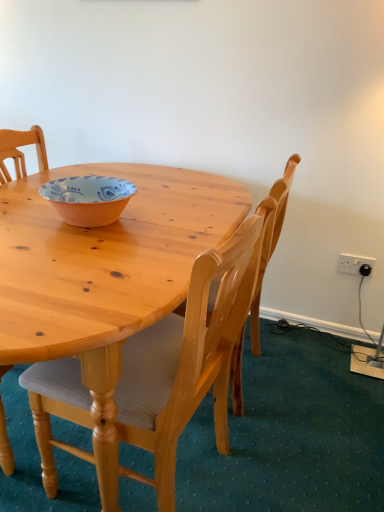
Question: Is light brown wood chair at center, which is the second chair in front-to-back order, at the right side of orange glazed bowl at center?

Choices:
 (A) no
 (B) yes

Answer: (B)

Question: Can you confirm if light brown wood chair at center, which is the second chair in front-to-back order, is thinner than orange glazed bowl at center?

Choices:
 (A) no
 (B) yes

Answer: (A)

Question: Is light brown wood chair at center, which is the second chair in front-to-back order, oriented away from orange glazed bowl at center?

Choices:
 (A) no
 (B) yes

Answer: (A)

Question: Is light brown wood chair at center, arranged as the first chair when viewed from the back, oriented towards orange glazed bowl at center?

Choices:
 (A) no
 (B) yes

Answer: (A)

Question: Considering the relative positions of light brown wood chair at center, which is the second chair in front-to-back order, and orange glazed bowl at center in the image provided, is light brown wood chair at center, which is the second chair in front-to-back order, in front of orange glazed bowl at center?

Choices:
 (A) yes
 (B) no

Answer: (B)

Question: From a real-world perspective, is light brown wood chair at center, arranged as the first chair when viewed from the back, on orange glazed bowl at center?

Choices:
 (A) no
 (B) yes

Answer: (A)

Question: Is light wood chair at center, the first chair positioned from the front, far away from white plastic power outlet at upper right?

Choices:
 (A) yes
 (B) no

Answer: (A)

Question: Does light wood chair at center, the first chair positioned from the front, have a larger size compared to white plastic power outlet at upper right?

Choices:
 (A) yes
 (B) no

Answer: (A)

Question: From the image's perspective, does light wood chair at center, the first chair positioned from the front, appear lower than white plastic power outlet at upper right?

Choices:
 (A) yes
 (B) no

Answer: (A)

Question: Is white plastic power outlet at upper right a part of light wood chair at center, the 2th chair from the back?

Choices:
 (A) yes
 (B) no

Answer: (B)

Question: Is light wood chair at center, the 2th chair from the back, taller than white plastic power outlet at upper right?

Choices:
 (A) yes
 (B) no

Answer: (A)

Question: Can you confirm if light wood chair at center, the first chair positioned from the front, is shorter than white plastic power outlet at upper right?

Choices:
 (A) yes
 (B) no

Answer: (B)

Question: Is white plastic power outlet at upper right at the back of orange glazed bowl at center?

Choices:
 (A) no
 (B) yes

Answer: (A)